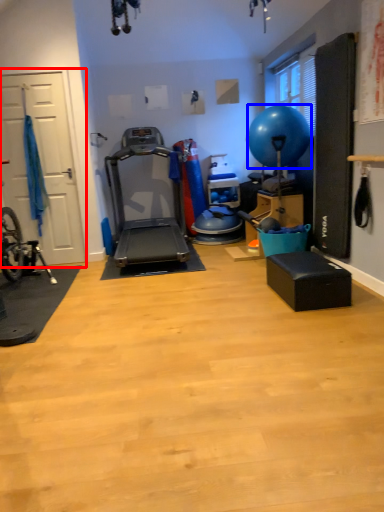
Question: Which object appears farthest to the camera in this image, garage door (highlighted by a red box) or balloon (highlighted by a blue box)?

Choices:
 (A) garage door
 (B) balloon

Answer: (A)